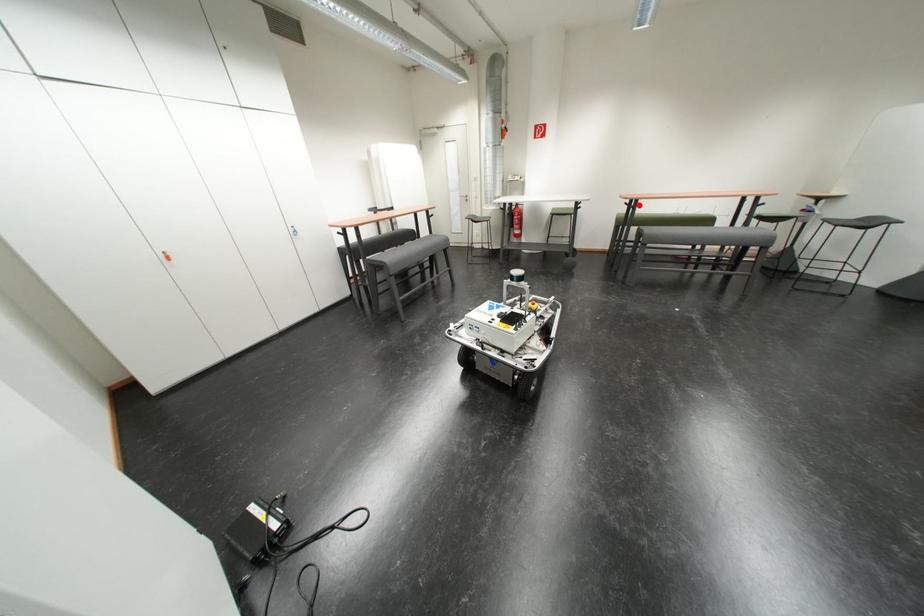
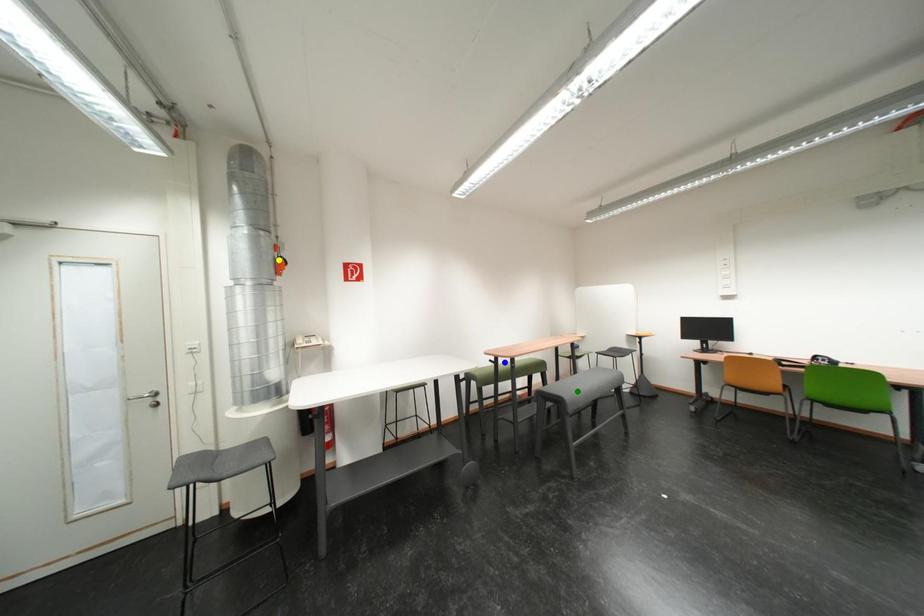
Question: I am providing you with two images of the same scene from different viewpoints. A red point is marked on the first image. You are given multiple points on the second image. Which point in image 2 represents the same 3d spot as the red point in image 1?

Choices:
 (A) yellow point
 (B) blue point
 (C) green point

Answer: (B)